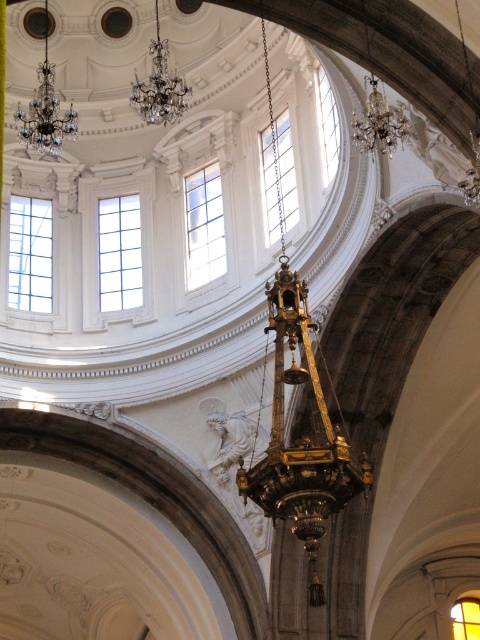
Is crystal glass chandelier at upper left positioned in front of crystal glass chandelier at upper right?

Yes, crystal glass chandelier at upper left is closer to the viewer.

Between crystal glass chandelier at upper left and crystal glass chandelier at upper right, which one appears on the right side from the viewer's perspective?

crystal glass chandelier at upper right

Which is in front, point (40, 70) or point (367, 131)?

Point (367, 131) is more forward.

The width and height of the screenshot is (480, 640). I want to click on crystal glass chandelier at upper left, so click(46, 109).

Is crystal glass chandelier at upper center smaller than crystal glass chandelier at upper right?

Actually, crystal glass chandelier at upper center might be larger than crystal glass chandelier at upper right.

Can you confirm if crystal glass chandelier at upper center is positioned below crystal glass chandelier at upper right?

Incorrect, crystal glass chandelier at upper center is not positioned below crystal glass chandelier at upper right.

The height and width of the screenshot is (640, 480). I want to click on crystal glass chandelier at upper center, so click(x=159, y=86).

Find the location of a particular element. crystal glass chandelier at upper center is located at coordinates (159, 86).

Who is shorter, crystal glass chandelier at upper left or crystal glass chandelier at upper center?

crystal glass chandelier at upper center is shorter.

Between crystal glass chandelier at upper left and crystal glass chandelier at upper center, which one is positioned lower?

crystal glass chandelier at upper left is lower down.

Which is in front, point (54, 76) or point (167, 122)?

Point (167, 122)

Where is `crystal glass chandelier at upper left`? crystal glass chandelier at upper left is located at coordinates pyautogui.click(x=46, y=109).